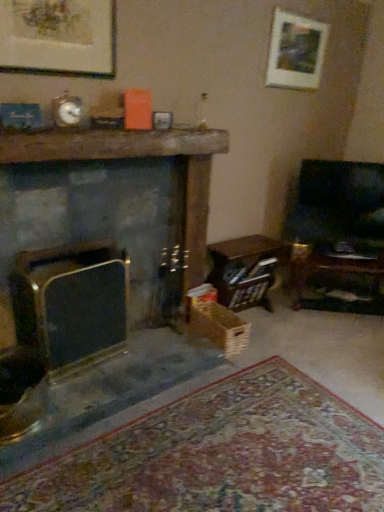
In order to click on vacant area located to the right-hand side of matte black fireplace at left, the second fireplace positioned from the right in this screenshot , I will do `click(141, 360)`.